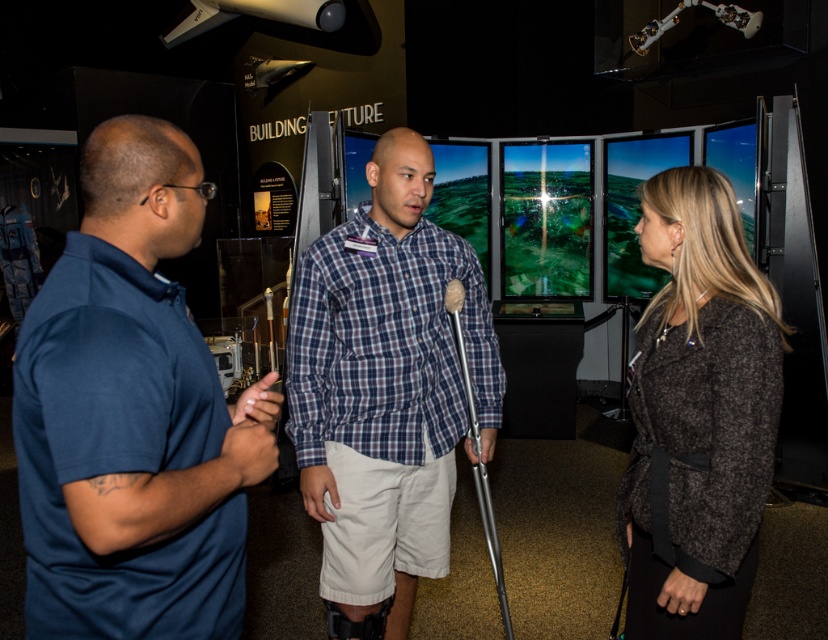
Between blue cotton polo shirt at left and dark gray woolen jacket at center, which one appears on the right side from the viewer's perspective?

Positioned to the right is dark gray woolen jacket at center.

At what (x,y) coordinates should I click in order to perform the action: click on blue cotton polo shirt at left. Please return your answer as a coordinate pair (x, y). The height and width of the screenshot is (640, 828). Looking at the image, I should click on (132, 413).

Can you confirm if dark gray woolen jacket at center is positioned to the left of silver metallic crutch at center?

In fact, dark gray woolen jacket at center is to the right of silver metallic crutch at center.

Looking at this image, who is more forward, (691, 353) or (460, 284)?

Positioned in front is point (691, 353).

Where is `dark gray woolen jacket at center`? This screenshot has width=828, height=640. dark gray woolen jacket at center is located at coordinates (697, 413).

Does blue plaid shirt at center appear over silver metallic crutch at center?

Indeed, blue plaid shirt at center is positioned over silver metallic crutch at center.

Is point (398, 627) in front of point (494, 528)?

That is False.

Where is `blue plaid shirt at center`? blue plaid shirt at center is located at coordinates (384, 390).